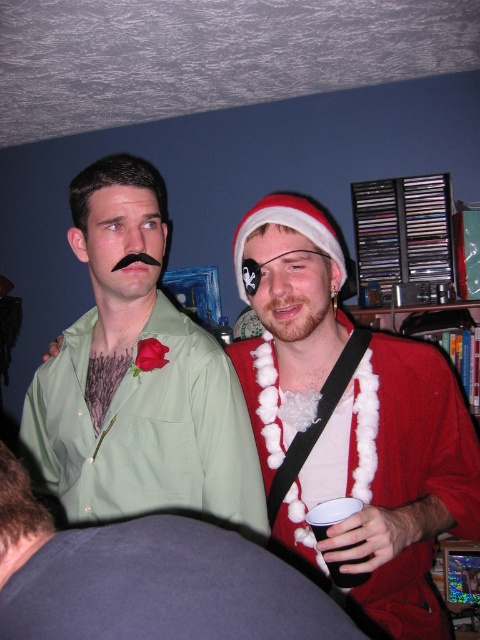
Between point (216, 372) and point (272, 320), which one is positioned behind?

Point (216, 372)

Does green matte shirt at center have a greater width compared to reddish-brown fuzzy beard at center?

Yes.

Describe the element at coordinates (137, 378) in the screenshot. The height and width of the screenshot is (640, 480). I see `green matte shirt at center` at that location.

At what (x,y) coordinates should I click in order to perform the action: click on green matte shirt at center. Please return your answer as a coordinate pair (x, y). This screenshot has width=480, height=640. Looking at the image, I should click on (137, 378).

Is green matte shirt at upper left positioned behind fuzzy white boa at center?

That is False.

Describe the element at coordinates (146, 579) in the screenshot. The image size is (480, 640). I see `green matte shirt at upper left` at that location.

Locate an element on the screen. green matte shirt at upper left is located at coordinates (146, 579).

Which is above, green matte shirt at center or green matte shirt at upper left?

green matte shirt at center

Is point (146, 426) closer to viewer compared to point (308, 596)?

That is False.

Where is `green matte shirt at center`? green matte shirt at center is located at coordinates (137, 378).